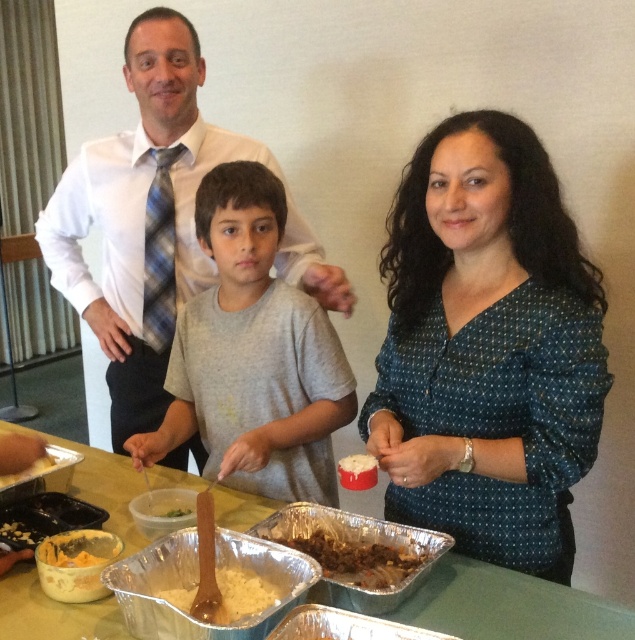
Question: Which point is closer to the camera taking this photo?

Choices:
 (A) (471, 273)
 (B) (135, 536)
 (C) (311, 525)

Answer: (A)

Question: Is gray cotton shirt at center further to the viewer compared to green matte food at center?

Choices:
 (A) no
 (B) yes

Answer: (A)

Question: Which object appears farthest from the camera in this image?

Choices:
 (A) dark blue dotted blouse at center
 (B) white creamy substance at center

Answer: (B)

Question: Does dark blue dotted blouse at center appear under white shirt at center?

Choices:
 (A) yes
 (B) no

Answer: (A)

Question: Which object is farther from the camera taking this photo?

Choices:
 (A) white fluffy rice at center
 (B) dark brown textured rice at lower left
 (C) green matte food at center
 (D) dark blue dotted blouse at center

Answer: (C)

Question: Is metallic silver tray at center above brown matte aluminum tray at center?

Choices:
 (A) no
 (B) yes

Answer: (B)